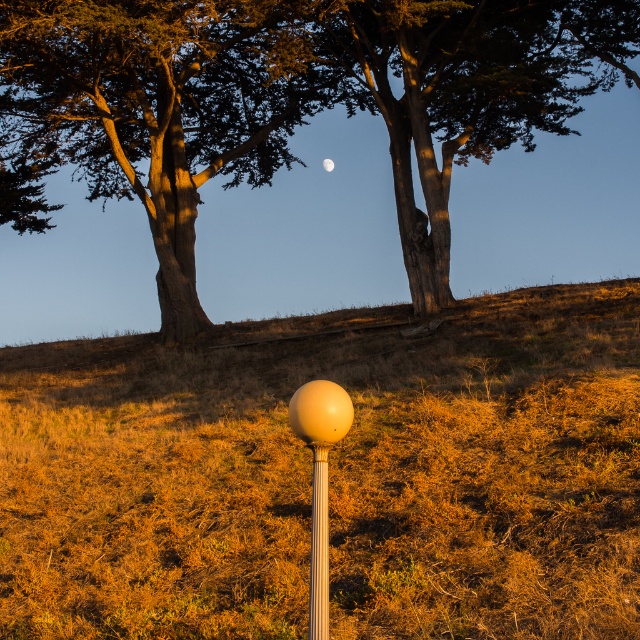
Is matte beige sphere at center bigger than white matte moon at upper center?

Yes.

Who is higher up, matte beige sphere at center or white matte moon at upper center?

white matte moon at upper center is higher up.

Who is more forward, (314, 429) or (323, 164)?

Point (314, 429) is in front.

Locate an element on the screen. Image resolution: width=640 pixels, height=640 pixels. matte beige sphere at center is located at coordinates (320, 480).

Can you confirm if matte beige sphere at center is thinner than metallic silver pole at center?

In fact, matte beige sphere at center might be wider than metallic silver pole at center.

Who is positioned more to the left, matte beige sphere at center or metallic silver pole at center?

From the viewer's perspective, metallic silver pole at center appears more on the left side.

Locate an element on the screen. matte beige sphere at center is located at coordinates (320, 480).

Locate an element on the screen. The width and height of the screenshot is (640, 640). matte beige sphere at center is located at coordinates (320, 480).

Can you confirm if metallic silver pole at center is positioned to the left of white matte moon at upper center?

In fact, metallic silver pole at center is to the right of white matte moon at upper center.

Measure the distance between point (326, 624) and camera.

4.73 meters

What are the coordinates of `metallic silver pole at center` in the screenshot? It's located at (317, 547).